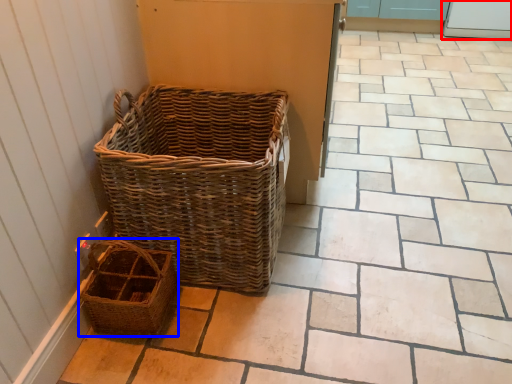
Question: Which object is closer to the camera taking this photo, screen door (highlighted by a red box) or picnic basket (highlighted by a blue box)?

Choices:
 (A) screen door
 (B) picnic basket

Answer: (B)